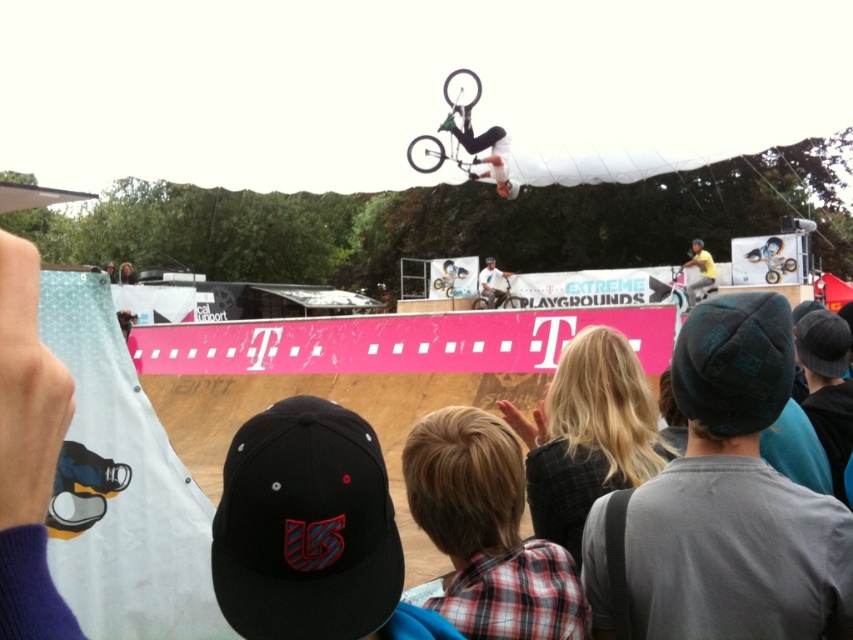
Question: Which point is farther to the camera?

Choices:
 (A) (490, 273)
 (B) (132, 269)
 (C) (782, 582)

Answer: (B)

Question: Can you confirm if blonde hair at center is wider than black knit cap at upper right?

Choices:
 (A) yes
 (B) no

Answer: (A)

Question: Which of the following is the farthest from the observer?

Choices:
 (A) (775, 236)
 (B) (491, 298)

Answer: (B)

Question: Observing the image, what is the correct spatial positioning of yellow matte shirt at upper center in reference to light brown leather jacket at upper center?

Choices:
 (A) right
 (B) left

Answer: (A)

Question: Among these objects, which one is nearest to the camera?

Choices:
 (A) black knit cap at upper right
 (B) yellow matte shirt at upper center

Answer: (A)

Question: Does black fabric cap at lower center have a greater width compared to black knit cap at upper right?

Choices:
 (A) yes
 (B) no

Answer: (A)